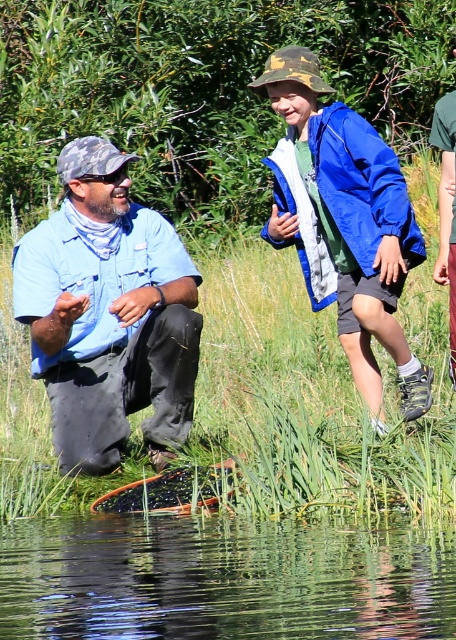
You are a photographer positioned behind the blue denim shirt at left and the blue fabric jacket at upper center. Which person should you focus on first to capture them in the frame?

You should focus on the blue denim shirt at left first because it is closer to you than the blue fabric jacket at upper center, which is further away.

You are a photographer planning to capture a group photo of the two individuals in the scene. You want to ensure both the blue denim shirt at left and the blue fabric jacket at upper center are clearly visible. Considering their sizes, which clothing item should you focus on first to frame the shot properly?

The blue denim shirt at left is wider than the blue fabric jacket at upper center, so you should focus on framing the blue denim shirt at left first to ensure it fits within the camera frame properly.

Consider the image. You are a photographer positioned at the edge of the pond. You want to take a photo that includes both the blue denim shirt at left and the blue matte jacket at upper center. Which of the two subjects will appear closer to the camera in the photo?

The blue denim shirt at left will appear closer to the camera because it is further to the viewer than the blue matte jacket at upper center, meaning it is positioned nearer to the photographer.